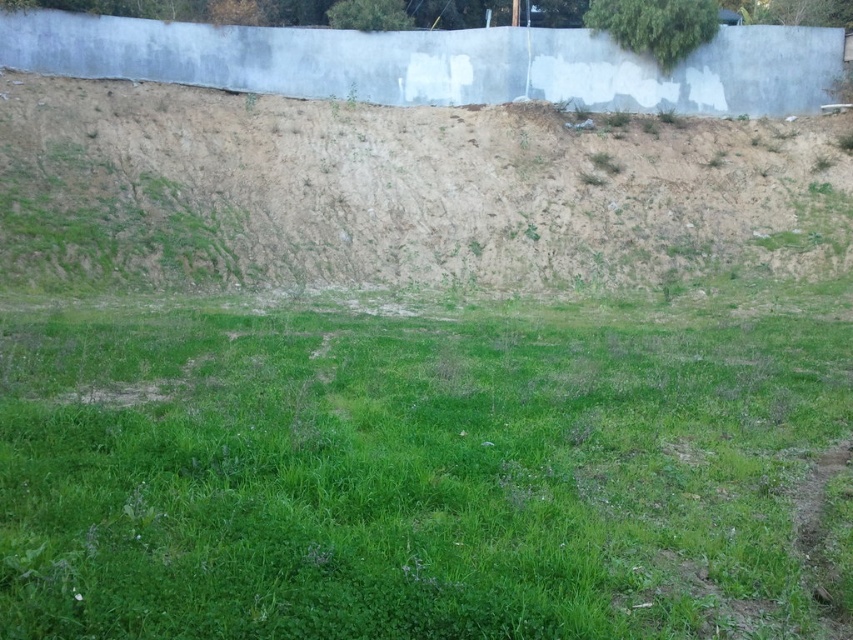
Question: Where is green grassy field at center located in relation to dull brown dirt at upper center in the image?

Choices:
 (A) right
 (B) left

Answer: (B)

Question: In this image, where is green grassy field at center located relative to dull brown dirt at upper center?

Choices:
 (A) above
 (B) below

Answer: (B)

Question: Which object appears closest to the camera in this image?

Choices:
 (A) dull brown dirt at upper center
 (B) green grassy field at center

Answer: (B)

Question: Is green grassy field at center further to the viewer compared to dull brown dirt at upper center?

Choices:
 (A) no
 (B) yes

Answer: (A)